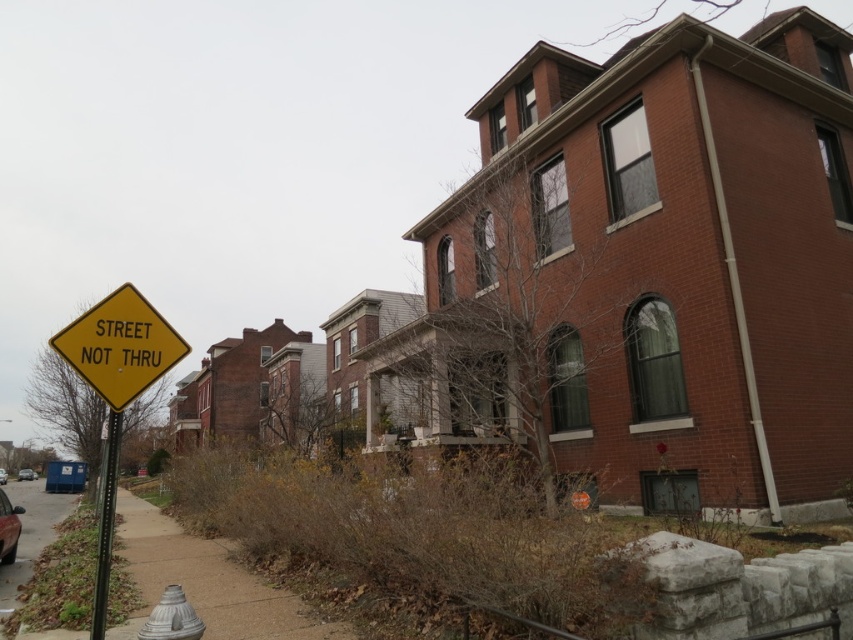
Question: Which of these objects is positioned farthest from the white matte hydrant at lower left?

Choices:
 (A) matte black car at lower left
 (B) black metal pole at left
 (C) yellow matte street sign at lower left

Answer: (A)

Question: Which object appears farthest from the camera in this image?

Choices:
 (A) yellow matte street sign at lower left
 (B) metallic silver car at lower left

Answer: (B)

Question: Can you confirm if shiny black car at lower left is bigger than matte black car at lower left?

Choices:
 (A) no
 (B) yes

Answer: (B)

Question: Can you confirm if yellow matte street sign at lower left is positioned below white matte hydrant at lower left?

Choices:
 (A) no
 (B) yes

Answer: (A)

Question: Is yellow matte street sign at lower left below concrete sidewalk at lower left?

Choices:
 (A) yes
 (B) no

Answer: (B)

Question: Estimate the real-world distances between objects in this image. Which object is farther from the black metal pole at left?

Choices:
 (A) metallic silver car at lower left
 (B) brown gravel sidewalk at lower left
 (C) shiny black car at lower left
 (D) concrete sidewalk at lower left

Answer: (A)